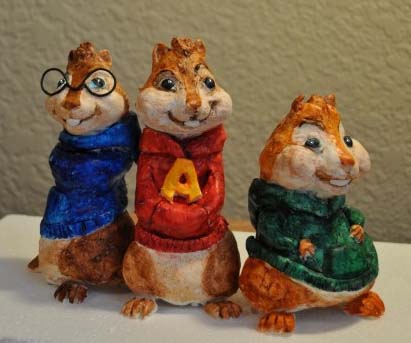
At what (x,y) coordinates should I click in order to perform the action: click on wall. Please return your answer as a coordinate pair (x, y). Looking at the image, I should click on (387, 222).